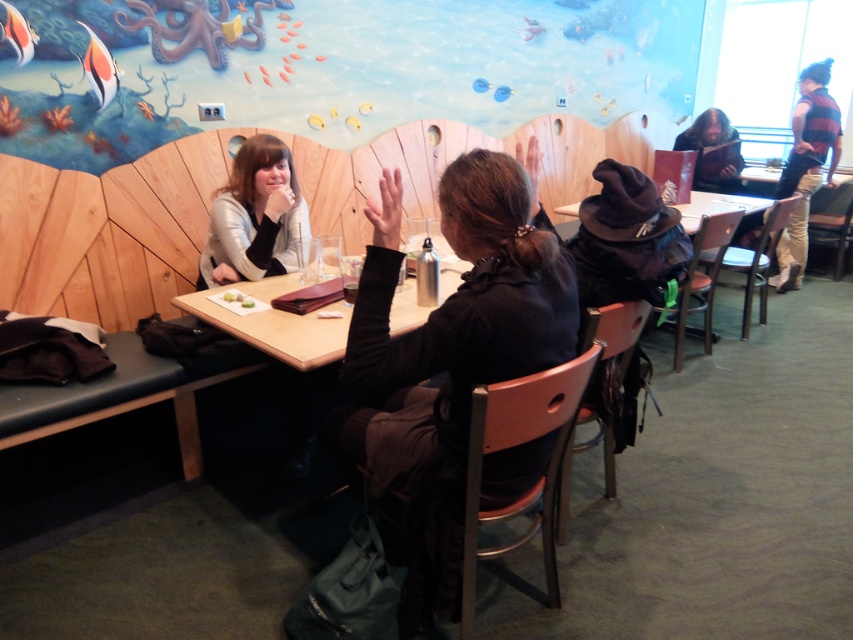
You are a customer sitting at the table in the image. You notice two points marked on the table. The first point is at coordinate point[267,145] and the second is at point[804,257]. If you want to reach both points starting from your current position, which point should you reach first to minimize the distance traveled?

To minimize the distance traveled, you should reach the point at point[267,145] first since it is closer to you than point[804,257]. This is because point[267,145] is in front of point[804,257], meaning it is closer to your current position at the table.

Looking at this image, you are a customer in this dining area and want to place your coffee mug on the wooden table at center. However, there is a striped wool sweater at upper right nearby. Can you place the mug there without it being under the sweater?

The wooden table at center is positioned under the striped wool sweater at upper right, so placing the mug there would mean it is under the sweater. Choose another spot on the table away from the sweater.

You are a server in a restaurant with a 2.5 meter long tray. You need to deliver a meal to the matte silver jacket at left. Can you reach them without moving closer?

The matte silver jacket at left and viewer are 2.40 meters apart. Since the tray is 2.5 meters long, you can reach them without moving closer.